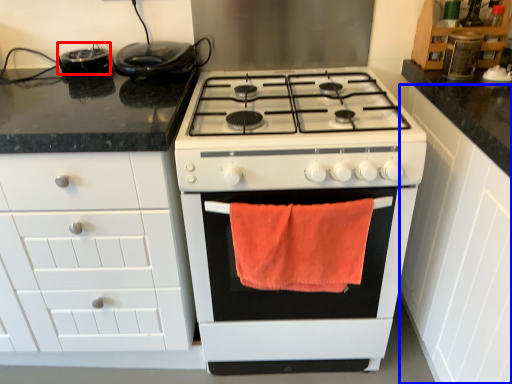
Question: Among these objects, which one is nearest to the camera, appliance (highlighted by a red box) or cabinetry (highlighted by a blue box)?

Choices:
 (A) appliance
 (B) cabinetry

Answer: (B)